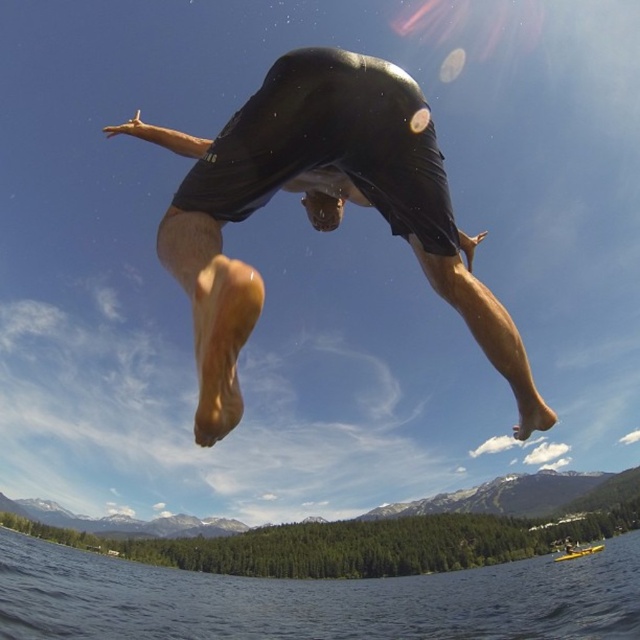
Question: Which of the following is the farthest from the observer?

Choices:
 (A) (394, 618)
 (B) (356, 116)

Answer: (A)

Question: Does transparent blue water at lower center appear under yellow plastic boat at lower right?

Choices:
 (A) no
 (B) yes

Answer: (A)

Question: Is black matte shorts at center smaller than yellow plastic boat at lower right?

Choices:
 (A) yes
 (B) no

Answer: (B)

Question: Which object is farther from the camera taking this photo?

Choices:
 (A) black matte shorts at center
 (B) black matte wetsuit at center

Answer: (B)

Question: Which object is closer to the camera taking this photo?

Choices:
 (A) black matte shorts at center
 (B) black matte wetsuit at center
 (C) transparent blue water at lower center
 (D) yellow plastic boat at lower right

Answer: (A)

Question: Does transparent blue water at lower center appear under black matte wetsuit at center?

Choices:
 (A) no
 (B) yes

Answer: (B)